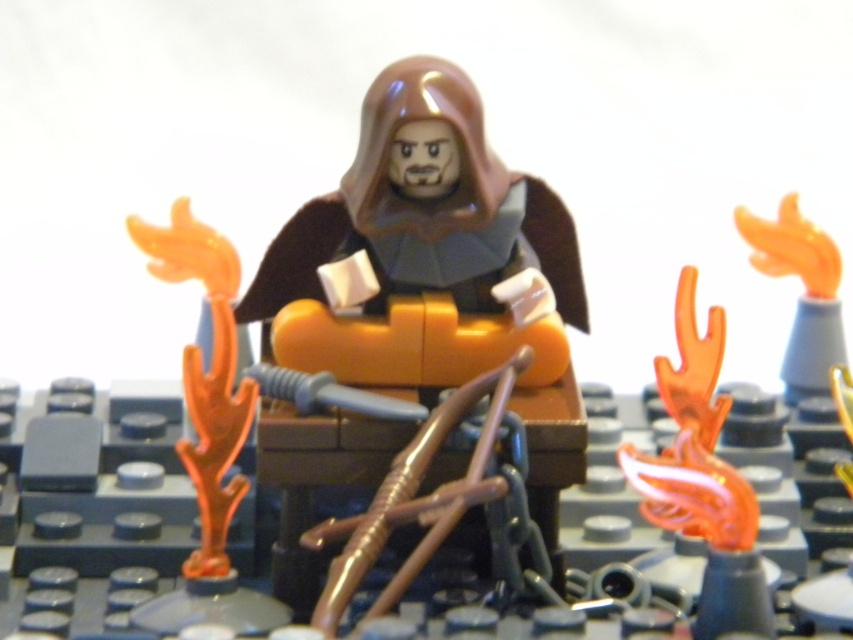
Is brown matte/soft robe at center further to the viewer compared to orange translucent flame at right?

No.

Is brown matte/soft robe at center wider than orange translucent flame at right?

Indeed, brown matte/soft robe at center has a greater width compared to orange translucent flame at right.

Who is more forward, (404, 332) or (814, 300)?

Positioned in front is point (404, 332).

Where is `brown matte/soft robe at center`? The image size is (853, 640). brown matte/soft robe at center is located at coordinates (434, 266).

Is brown matte/soft robe at center behind translucent orange flame at upper right?

No, brown matte/soft robe at center is in front of translucent orange flame at upper right.

Between brown matte/soft robe at center and translucent orange flame at upper right, which one appears on the right side from the viewer's perspective?

Positioned to the right is translucent orange flame at upper right.

You are a GUI agent. You are given a task and a screenshot of the screen. Output one action in this format:
    pyautogui.click(x=<x>, y=<y>)
    Task: Click on the brown matte/soft robe at center
    The height and width of the screenshot is (640, 853).
    Given the screenshot: What is the action you would take?
    pyautogui.click(x=434, y=266)

Between point (688, 493) and point (788, 241), which one is positioned in front?

Point (688, 493)

Between point (734, 593) and point (746, 230), which one is positioned behind?

Positioned behind is point (746, 230).

Is point (711, 605) behind point (816, 320)?

No.

Identify the location of translucent orange flame at upper right. [x=703, y=477].